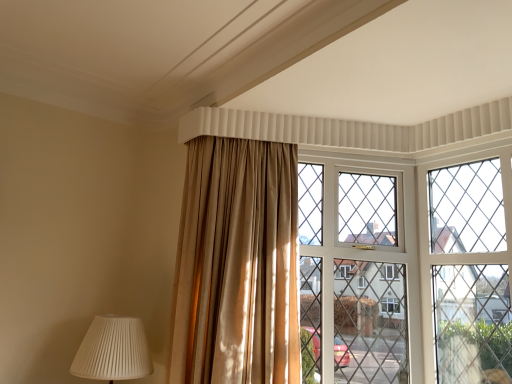
Question: Is white pleated lampshade at lower left to the right of satin gold curtain at center from the viewer's perspective?

Choices:
 (A) no
 (B) yes

Answer: (A)

Question: Does white pleated lampshade at lower left lie behind satin gold curtain at center?

Choices:
 (A) no
 (B) yes

Answer: (B)

Question: Does white pleated lampshade at lower left have a greater height compared to satin gold curtain at center?

Choices:
 (A) yes
 (B) no

Answer: (B)

Question: Are white pleated lampshade at lower left and satin gold curtain at center far apart?

Choices:
 (A) no
 (B) yes

Answer: (A)

Question: Is satin gold curtain at center inside white pleated lampshade at lower left?

Choices:
 (A) yes
 (B) no

Answer: (B)

Question: Is white pleated lampshade at lower left positioned before satin gold curtain at center?

Choices:
 (A) no
 (B) yes

Answer: (A)

Question: Would you say white pleated lampshade at lower left is part of satin gold curtain at center's contents?

Choices:
 (A) yes
 (B) no

Answer: (B)

Question: Is satin gold curtain at center bigger than white pleated lampshade at lower left?

Choices:
 (A) no
 (B) yes

Answer: (B)

Question: Does satin gold curtain at center come in front of white pleated lampshade at lower left?

Choices:
 (A) yes
 (B) no

Answer: (A)

Question: From the image's perspective, does satin gold curtain at center appear lower than white pleated lampshade at lower left?

Choices:
 (A) no
 (B) yes

Answer: (A)

Question: From a real-world perspective, is satin gold curtain at center located beneath white pleated lampshade at lower left?

Choices:
 (A) no
 (B) yes

Answer: (A)

Question: Considering the relative sizes of satin gold curtain at center and white pleated lampshade at lower left in the image provided, is satin gold curtain at center thinner than white pleated lampshade at lower left?

Choices:
 (A) no
 (B) yes

Answer: (B)

Question: Is white pleated lampshade at lower left closer to camera compared to clear glass window at center?

Choices:
 (A) no
 (B) yes

Answer: (B)